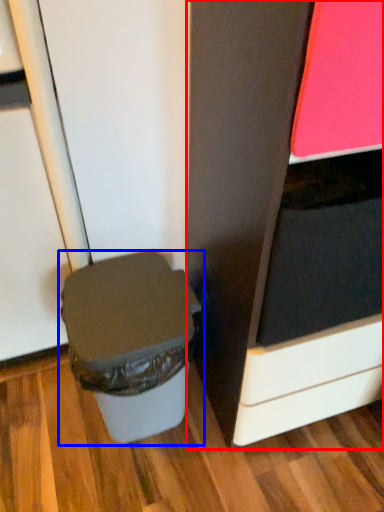
Question: Which object appears farthest to the camera in this image, cabinetry (highlighted by a red box) or waste container (highlighted by a blue box)?

Choices:
 (A) cabinetry
 (B) waste container

Answer: (B)